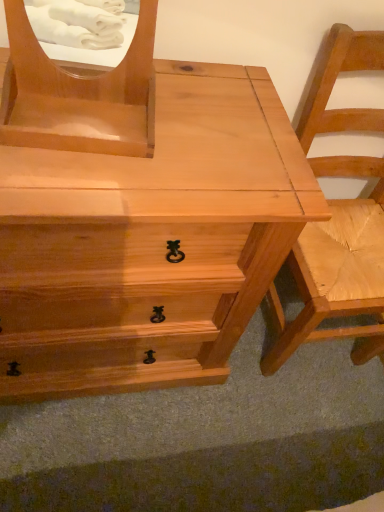
The width and height of the screenshot is (384, 512). What do you see at coordinates (79, 95) in the screenshot?
I see `matte wood mirror at upper left` at bounding box center [79, 95].

This screenshot has width=384, height=512. I want to click on natural wood chest of drawers at center, so click(x=150, y=241).

Is natural wood chest of drawers at center oriented away from matte wood mirror at upper left?

natural wood chest of drawers at center does not have its back to matte wood mirror at upper left.

Which object is wider, natural wood chest of drawers at center or matte wood mirror at upper left?

Wider between the two is natural wood chest of drawers at center.

Choose the correct answer: Is natural wood chest of drawers at center inside matte wood mirror at upper left or outside it?

natural wood chest of drawers at center lies outside matte wood mirror at upper left.

You are a GUI agent. You are given a task and a screenshot of the screen. Output one action in this format:
    pyautogui.click(x=<x>, y=<y>)
    Task: Click on the chest of drawers located behind the matte wood mirror at upper left
    This screenshot has width=384, height=512.
    Given the screenshot: What is the action you would take?
    pos(150,241)

Is natural wood chair at right outside of natural wood chest of drawers at center?

natural wood chair at right is positioned outside natural wood chest of drawers at center.

Between natural wood chair at right and natural wood chest of drawers at center, which one is positioned behind?

natural wood chair at right is further away from the camera.

Is natural wood chair at right turned away from natural wood chest of drawers at center?

natural wood chair at right is not turned away from natural wood chest of drawers at center.

Who is bigger, natural wood chair at right or natural wood chest of drawers at center?

Bigger between the two is natural wood chest of drawers at center.

Are matte wood mirror at upper left and natural wood chair at right making contact?

No.

Is matte wood mirror at upper left further to the viewer compared to natural wood chair at right?

No, the depth of matte wood mirror at upper left is less than that of natural wood chair at right.

Considering the sizes of objects matte wood mirror at upper left and natural wood chair at right in the image provided, who is smaller, matte wood mirror at upper left or natural wood chair at right?

matte wood mirror at upper left.

Looking at this image, how many degrees apart are the facing directions of matte wood mirror at upper left and natural wood chair at right?

4.21 degrees.

Considering the relative positions of natural wood chair at right and matte wood mirror at upper left in the image provided, is natural wood chair at right in front of matte wood mirror at upper left?

No, natural wood chair at right is further to the viewer.

Consider the image. Which is more to the right, natural wood chair at right or matte wood mirror at upper left?

From the viewer's perspective, natural wood chair at right appears more on the right side.

In the scene shown: Which of these two, natural wood chair at right or matte wood mirror at upper left, stands shorter?

matte wood mirror at upper left is shorter.

Is point (307, 329) farther from viewer compared to point (102, 80)?

Yes, it is.

From a real-world perspective, which object rests below the other?

natural wood chest of drawers at center is physically lower.

Is natural wood chest of drawers at center outside of natural wood chair at right?

That's correct, natural wood chest of drawers at center is outside of natural wood chair at right.

At what (x,y) coordinates should I click in order to perform the action: click on chair behind the natural wood chest of drawers at center. Please return your answer as a coordinate pair (x, y). This screenshot has width=384, height=512. Looking at the image, I should click on (337, 268).

Based on their sizes in the image, would you say matte wood mirror at upper left is bigger or smaller than natural wood chest of drawers at center?

Considering their sizes, matte wood mirror at upper left takes up less space than natural wood chest of drawers at center.

Can you confirm if matte wood mirror at upper left is positioned to the left of natural wood chest of drawers at center?

Incorrect, matte wood mirror at upper left is not on the left side of natural wood chest of drawers at center.

Is matte wood mirror at upper left wider than natural wood chest of drawers at center?

Incorrect, the width of matte wood mirror at upper left does not surpass that of natural wood chest of drawers at center.

How far apart are matte wood mirror at upper left and natural wood chest of drawers at center?

matte wood mirror at upper left and natural wood chest of drawers at center are 10.07 inches apart.

In the image, there is a matte wood mirror at upper left. Where is `the chest of drawers below it (from a real-world perspective)`? The image size is (384, 512). the chest of drawers below it (from a real-world perspective) is located at coordinates pos(150,241).

The height and width of the screenshot is (512, 384). What are the coordinates of `chest of drawers on the left side of natural wood chair at right` in the screenshot? It's located at (150, 241).

Looking at the image, which one is located further to natural wood chair at right, natural wood chest of drawers at center or matte wood mirror at upper left?

Based on the image, matte wood mirror at upper left appears to be further to natural wood chair at right.

Looking at the image, which one is located closer to matte wood mirror at upper left, natural wood chest of drawers at center or natural wood chair at right?

natural wood chest of drawers at center is positioned closer to the anchor matte wood mirror at upper left.

When comparing their distances from natural wood chest of drawers at center, does natural wood chair at right or matte wood mirror at upper left seem closer?

matte wood mirror at upper left.

Considering their positions, is natural wood chair at right positioned further to matte wood mirror at upper left than natural wood chest of drawers at center?

natural wood chair at right.

Looking at the image, which one is located closer to natural wood chair at right, matte wood mirror at upper left or natural wood chest of drawers at center?

natural wood chest of drawers at center lies closer to natural wood chair at right than the other object.

In the scene shown: Considering their positions, is matte wood mirror at upper left positioned closer to natural wood chest of drawers at center than natural wood chair at right?

Based on the image, matte wood mirror at upper left appears to be nearer to natural wood chest of drawers at center.

I want to click on mirror between natural wood chest of drawers at center and natural wood chair at right, so click(x=79, y=95).